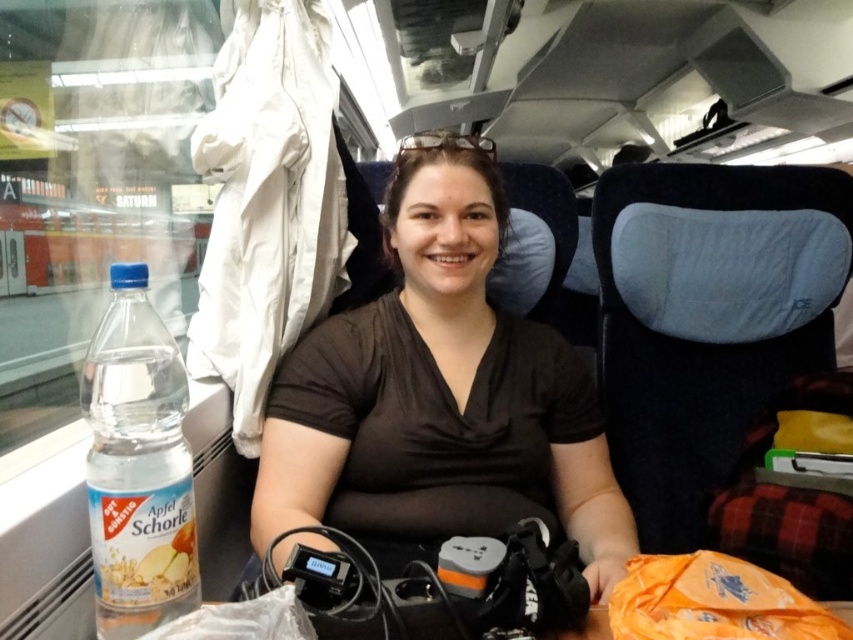
You are a passenger in a train carriage and need to reach the clear plastic goggles at upper center from the black matte shirt at center. Is the distance between them sufficient for you to comfortably stretch and grab the goggles without leaving your seat?

The distance between the black matte shirt at center and the clear plastic goggles at upper center is 4.76 meters. Since this distance is quite large, you would not be able to comfortably stretch and grab the goggles from your seat without moving closer.

You are a passenger on the train and need to place your orange fabric bag at lower right on the table in front of you. Is there enough space between the Apfel Schorle bottle and the electronic device next to it to fit the bag?

The orange fabric bag at lower right is located at point [712,602], so it is not on the table but at the lower right of the image. Therefore, there is no space between the Apfel Schorle bottle and the electronic device to place the bag.